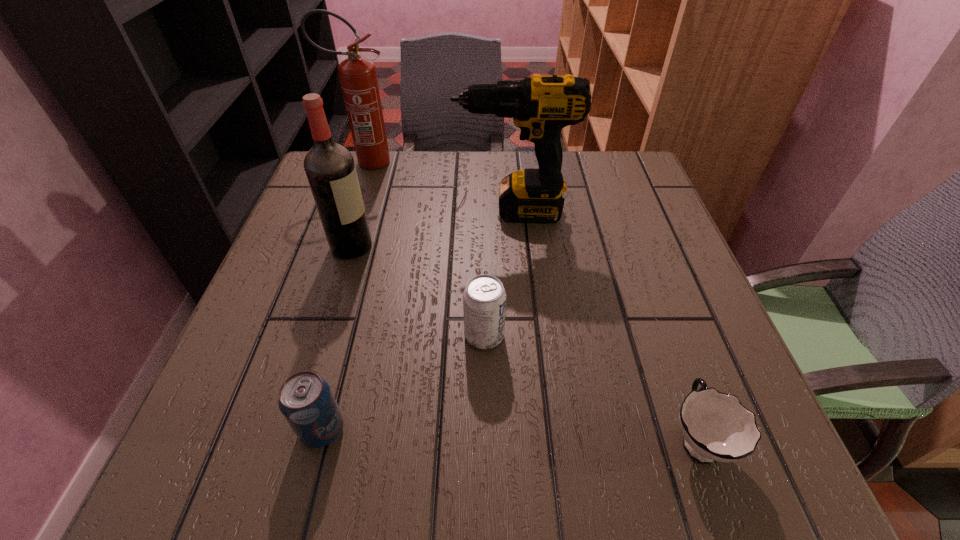
Find the location of `free space at the near edge`. free space at the near edge is located at coordinates (640, 482).

Locate an element on the screen. The height and width of the screenshot is (540, 960). vacant space at the left edge of the desktop is located at coordinates (300, 334).

Where is `free space at the right edge`? Image resolution: width=960 pixels, height=540 pixels. free space at the right edge is located at coordinates point(616,226).

Identify the location of vacant space at the near left corner. This screenshot has height=540, width=960. (238, 428).

In the image, there is a desktop. Identify the location of vacant region at the far right corner. (618, 172).

Image resolution: width=960 pixels, height=540 pixels. Identify the location of vacant space at the near right corner. (769, 436).

Identify the location of empty space that is in between the right pop soda and the fire extinguisher. (425, 248).

I want to click on free space between the fourth farthest object and the shortest object, so click(590, 387).

You are a GUI agent. You are given a task and a screenshot of the screen. Output one action in this format:
    pyautogui.click(x=<x>, y=<y>)
    Task: Click on the vacant point located between the second farthest object and the nearer pop soda
    The height and width of the screenshot is (540, 960).
    Given the screenshot: What is the action you would take?
    pyautogui.click(x=418, y=320)

You are a GUI agent. You are given a task and a screenshot of the screen. Output one action in this format:
    pyautogui.click(x=<x>, y=<y>)
    Task: Click on the empty space that is in between the drill and the cup
    
    Given the screenshot: What is the action you would take?
    pyautogui.click(x=605, y=325)